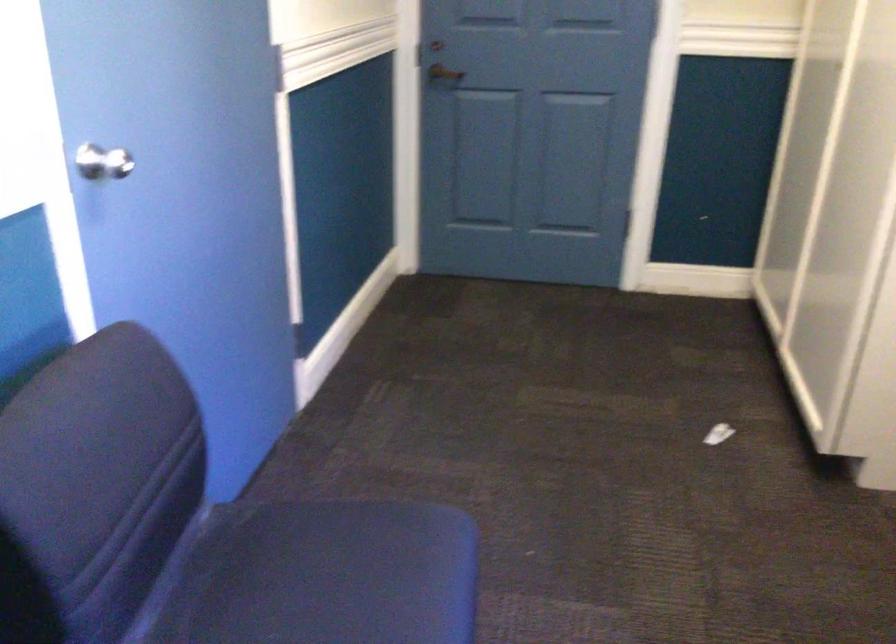
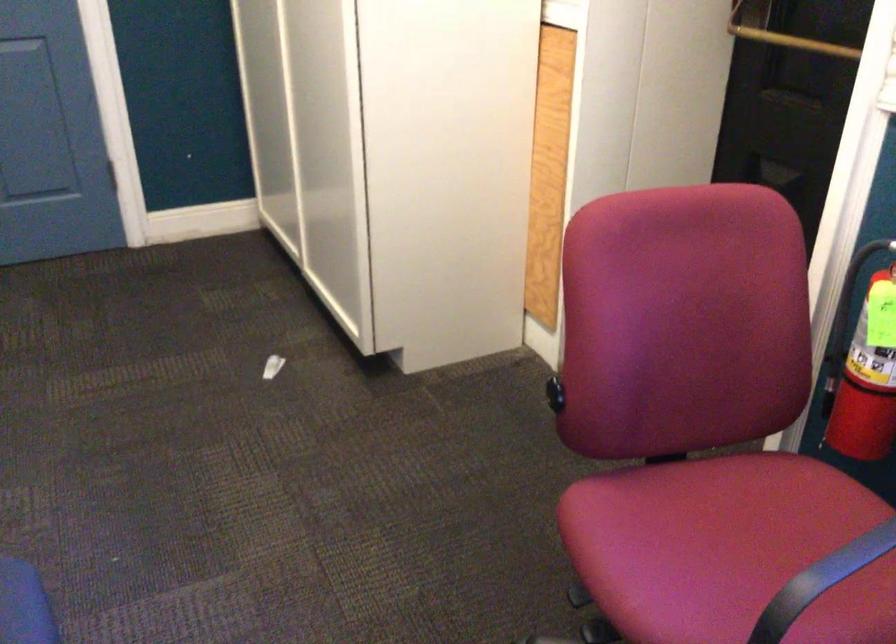
Find the pixel in the second image that matches (x=718, y=437) in the first image.

(271, 366)